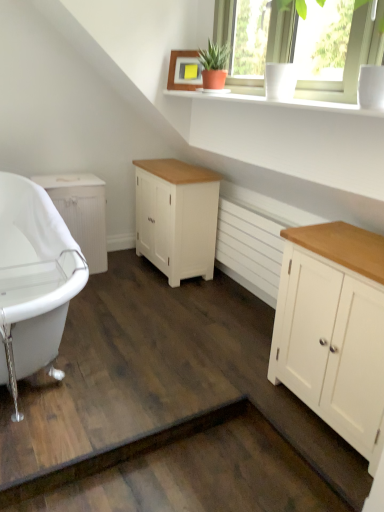
Question: Does white matte radiator at center have a smaller size compared to white painted wood cabinet at right, which is the third cabinetry in back-to-front order?

Choices:
 (A) yes
 (B) no

Answer: (A)

Question: Can white painted wood cabinet at right, the 3th cabinetry viewed from the left, be found inside white matte radiator at center?

Choices:
 (A) yes
 (B) no

Answer: (B)

Question: From a real-world perspective, is white matte radiator at center located beneath white painted wood cabinet at right, which appears as the 1th cabinetry when viewed from the right?

Choices:
 (A) no
 (B) yes

Answer: (B)

Question: Is white matte radiator at center positioned with its back to white painted wood cabinet at right, which is the third cabinetry in back-to-front order?

Choices:
 (A) no
 (B) yes

Answer: (A)

Question: From a real-world perspective, is white matte radiator at center physically above white painted wood cabinet at right, which is the third cabinetry in back-to-front order?

Choices:
 (A) no
 (B) yes

Answer: (A)

Question: Is white matte radiator at center thinner than white painted wood cabinet at right, the 3th cabinetry viewed from the left?

Choices:
 (A) no
 (B) yes

Answer: (B)

Question: Is white painted wood cabinet at right, which is the third cabinetry in back-to-front order, facing towards white glossy bathtub at lower left?

Choices:
 (A) no
 (B) yes

Answer: (A)

Question: Is white painted wood cabinet at right, which appears as the 1th cabinetry when viewed from the right, thinner than white glossy bathtub at lower left?

Choices:
 (A) no
 (B) yes

Answer: (B)

Question: Can you confirm if white painted wood cabinet at right, which is the third cabinetry in back-to-front order, is bigger than white glossy bathtub at lower left?

Choices:
 (A) yes
 (B) no

Answer: (B)

Question: Can you confirm if white painted wood cabinet at right, which is counted as the first cabinetry, starting from the front, is taller than white glossy bathtub at lower left?

Choices:
 (A) no
 (B) yes

Answer: (B)

Question: Is white painted wood cabinet at right, the 3th cabinetry viewed from the left, at the right side of white glossy bathtub at lower left?

Choices:
 (A) no
 (B) yes

Answer: (B)

Question: Is white painted wood cabinet at right, which appears as the 1th cabinetry when viewed from the right, completely or partially outside of white glossy cup at upper right?

Choices:
 (A) no
 (B) yes

Answer: (B)